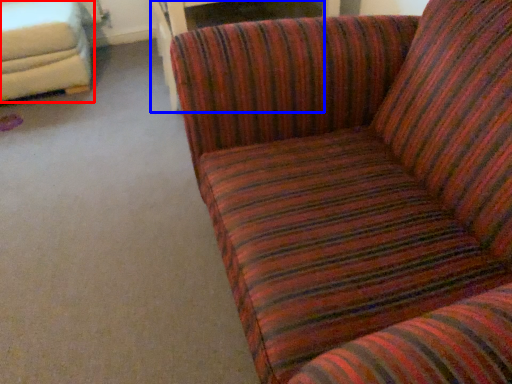
Question: Which object is closer to the camera taking this photo, studio couch (highlighted by a red box) or table (highlighted by a blue box)?

Choices:
 (A) studio couch
 (B) table

Answer: (B)